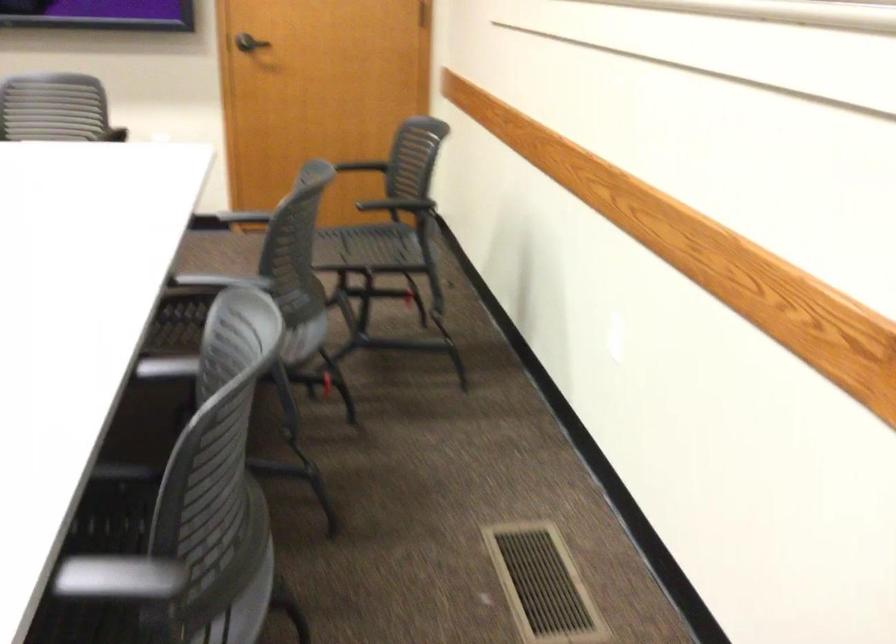
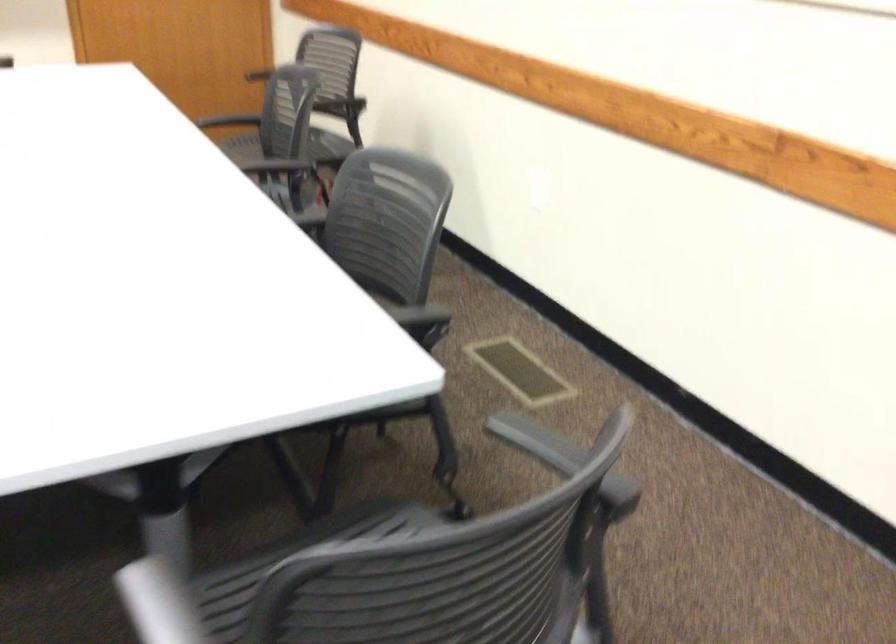
In the second image, find the point that corresponds to (268,257) in the first image.

(294, 144)